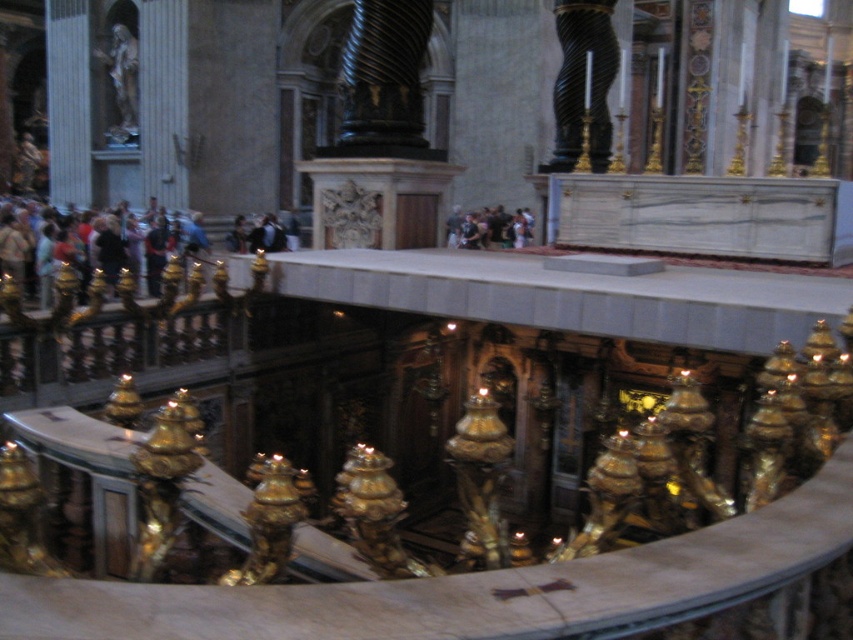
You are a visitor standing in the cathedral and want to take a photo of the matte gold statue at center and the dark clothing at center. Which object will appear larger in the photo?

The matte gold statue at center will appear larger in the photo because it is much taller than the dark clothing at center.

You are an interior designer planning to place a new sculpture in the cathedral. You observe the matte black jacket at left and the matte gold statue at center. Which object should you consider in terms of size when choosing a pedestal to ensure it can support the sculpture?

The matte black jacket at left is larger than the matte gold statue at center, so you should consider the size of the matte black jacket at left when choosing a pedestal to ensure it can support the sculpture.